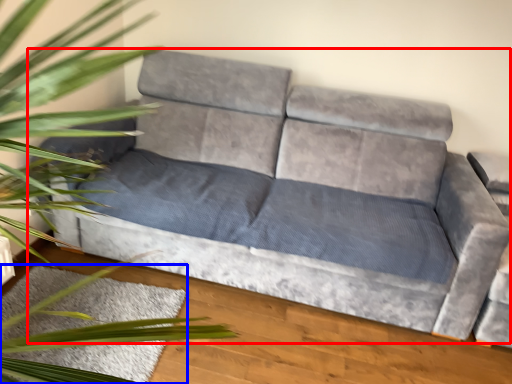
Question: Which point is further to the camera, studio couch (highlighted by a red box) or mat (highlighted by a blue box)?

Choices:
 (A) studio couch
 (B) mat

Answer: (B)